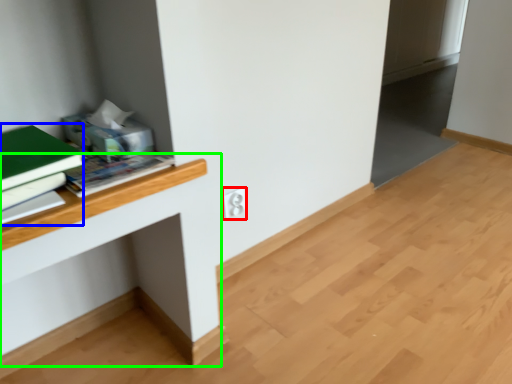
Question: Which object is the closest to the electric outlet (highlighted by a red box)? Choose among these: paperback book (highlighted by a blue box) or computer desk (highlighted by a green box).

Choices:
 (A) paperback book
 (B) computer desk

Answer: (B)